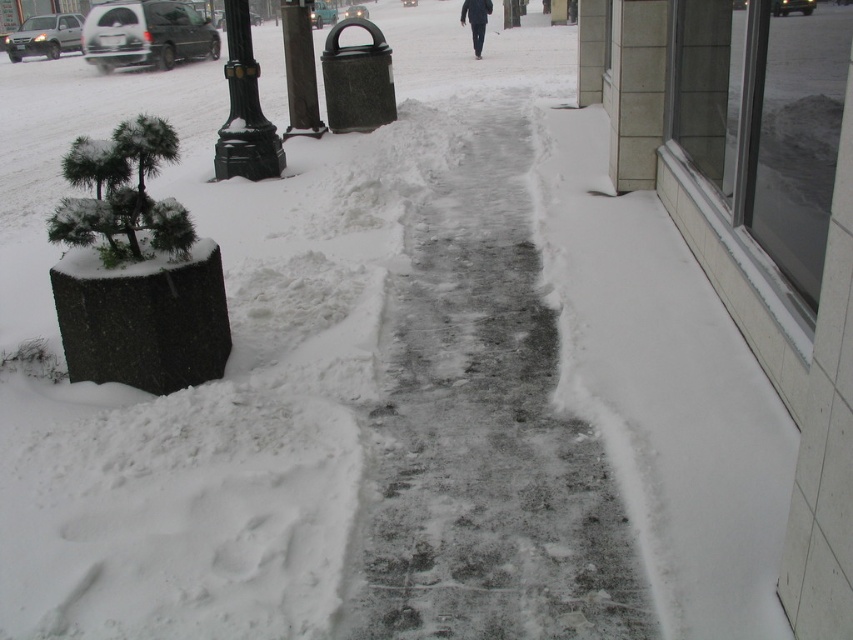
You are standing on the snowy sidewalk and see two points marked on the cleared pathway. The first point is at coordinate point (282, 138) and the second is at point (485, 20). Which point is closer to you?

Point (282, 138) is closer to the viewer than point (485, 20).

You are a delivery person with a cart that is 3 feet wide. You need to move from the sanded concrete pole at center to the black matte pants at center along the cleared path. Can your cart fit through the space between them?

The sanded concrete pole at center is 32.92 feet from the black matte pants at center. Since the cart is only 3 feet wide, there is more than enough space for it to pass through the 32.92 feet gap between them.